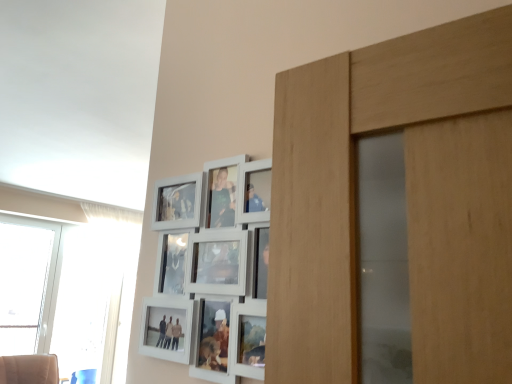
Question: Which is correct: transparent glass window at left, the first window from the left, is inside transparent glass window at left, which is counted as the second window, starting from the left, or outside of it?

Choices:
 (A) outside
 (B) inside

Answer: (A)

Question: Is transparent glass window at left, the first window from the left, in front of or behind transparent glass window at left, which is counted as the second window, starting from the left, in the image?

Choices:
 (A) front
 (B) behind

Answer: (A)

Question: Is point (9, 316) closer or farther from the camera than point (75, 253)?

Choices:
 (A) closer
 (B) farther

Answer: (A)

Question: From a real-world perspective, relative to transparent glass window at left, acting as the 2th window starting from the right, is transparent glass window at left, which is counted as the second window, starting from the left, vertically above or below?

Choices:
 (A) below
 (B) above

Answer: (A)

Question: Is point (106, 286) closer or farther from the camera than point (16, 249)?

Choices:
 (A) farther
 (B) closer

Answer: (A)

Question: Considering their positions, is transparent glass window at left, which is counted as the second window, starting from the left, located in front of or behind transparent glass window at left, acting as the 2th window starting from the right?

Choices:
 (A) front
 (B) behind

Answer: (B)

Question: Is transparent glass window at left, the 1th window when ordered from right to left, situated inside transparent glass window at left, the first window from the left, or outside?

Choices:
 (A) inside
 (B) outside

Answer: (B)